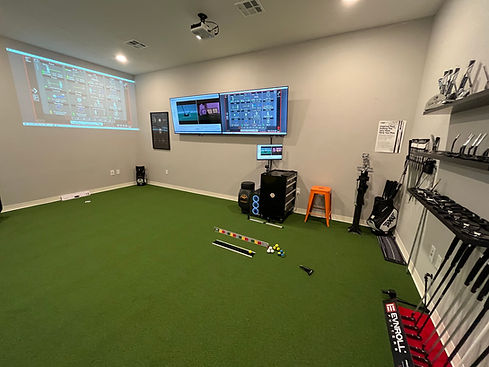
Find the location of a particular element. This screenshot has width=489, height=367. wall outlet is located at coordinates coord(115,165).